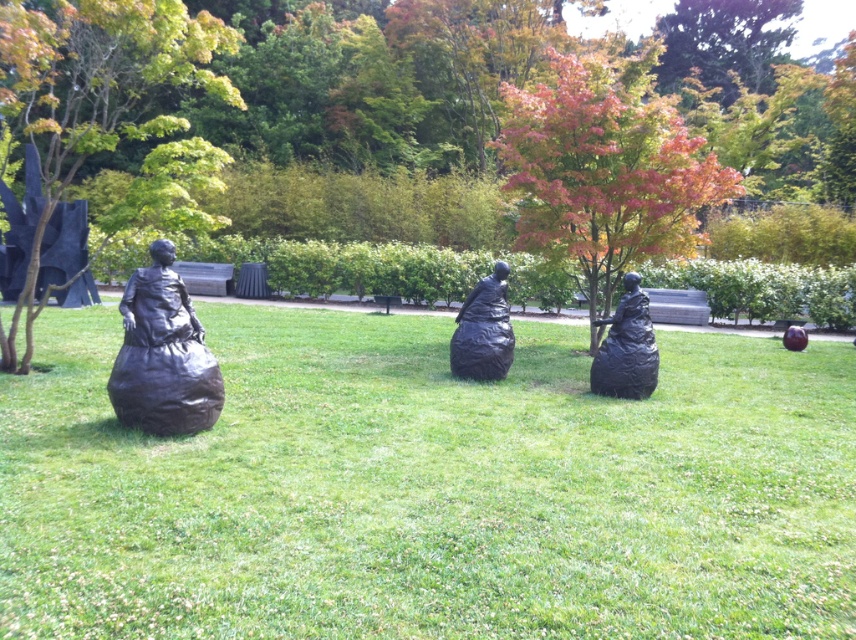
Question: Among these objects, which one is farthest from the camera?

Choices:
 (A) green leafy tree at left
 (B) bronze figure at center
 (C) black matte figure at left

Answer: (B)

Question: Considering the relative positions of autumn leaves at center and green leafy tree at left in the image provided, where is autumn leaves at center located with respect to green leafy tree at left?

Choices:
 (A) left
 (B) right

Answer: (B)

Question: Can you confirm if green leafy tree at left is wider than bronze statue at center?

Choices:
 (A) no
 (B) yes

Answer: (B)

Question: Does autumn leaves at center lie behind bronze park bench at center?

Choices:
 (A) yes
 (B) no

Answer: (B)

Question: Which object is farther from the camera taking this photo?

Choices:
 (A) smooth brown tree at center
 (B) autumn leaves at center

Answer: (B)

Question: Among these objects, which one is farthest from the camera?

Choices:
 (A) green grass at center
 (B) autumn leaves at center

Answer: (B)